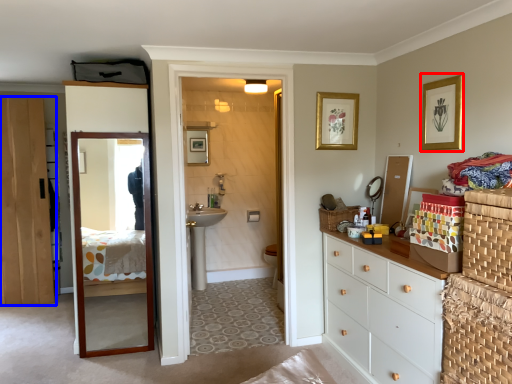
Question: Which object is further to the camera taking this photo, picture frame (highlighted by a red box) or door (highlighted by a blue box)?

Choices:
 (A) picture frame
 (B) door

Answer: (B)